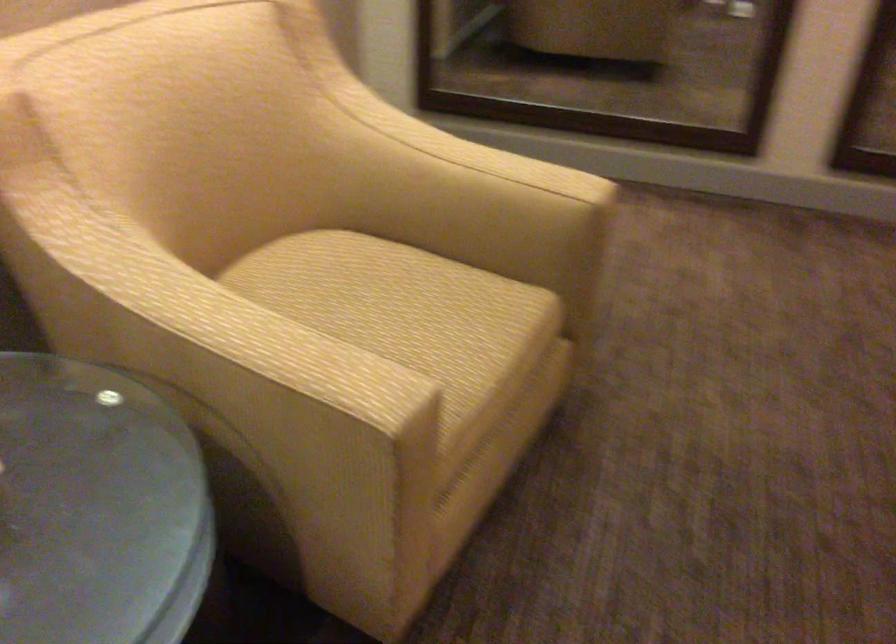
The images are taken continuously from a first-person perspective. In which direction is your viewpoint rotating?

The camera's rotation is toward left-down.